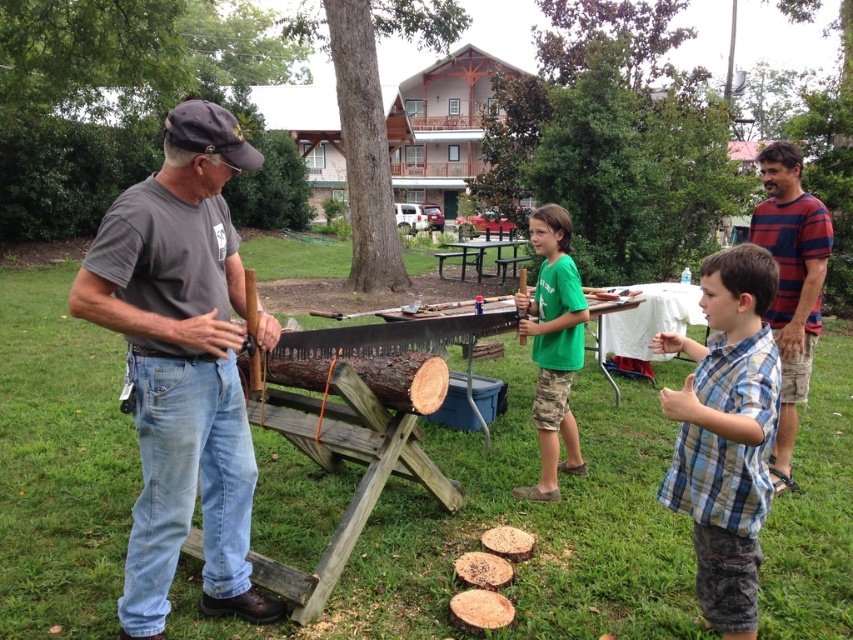
Where is `gray cotton t-shirt at left`? gray cotton t-shirt at left is located at coordinates (181, 365).

Locate an element on the screen. The width and height of the screenshot is (853, 640). gray cotton t-shirt at left is located at coordinates (181, 365).

In the scene shown: Does blue striped shirt at upper right come in front of green cotton shirt at center?

Yes.

Can you confirm if blue striped shirt at upper right is wider than green cotton shirt at center?

Yes.

Between point (787, 310) and point (543, 499), which one is positioned behind?

The point (787, 310) is behind.

At what (x,y) coordinates should I click in order to perform the action: click on blue striped shirt at upper right. Please return your answer as a coordinate pair (x, y). This screenshot has height=640, width=853. Looking at the image, I should click on (791, 284).

Which is in front, point (790, 401) or point (480, 241)?

Point (790, 401) is more forward.

Can you confirm if blue striped shirt at upper right is positioned above black plastic picnic table at center?

No.

You are a GUI agent. You are given a task and a screenshot of the screen. Output one action in this format:
    pyautogui.click(x=<x>, y=<y>)
    Task: Click on the blue striped shirt at upper right
    
    Given the screenshot: What is the action you would take?
    791,284